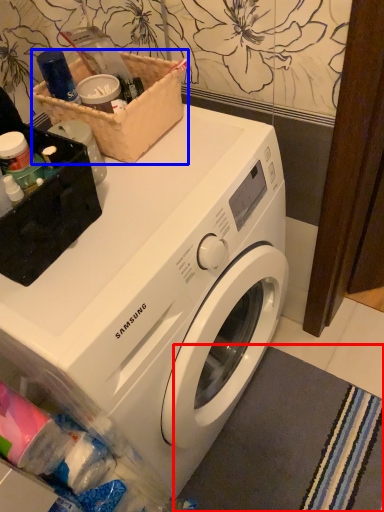
Question: Which object appears closest to the camera in this image, bath mat (highlighted by a red box) or basket (highlighted by a blue box)?

Choices:
 (A) bath mat
 (B) basket

Answer: (B)